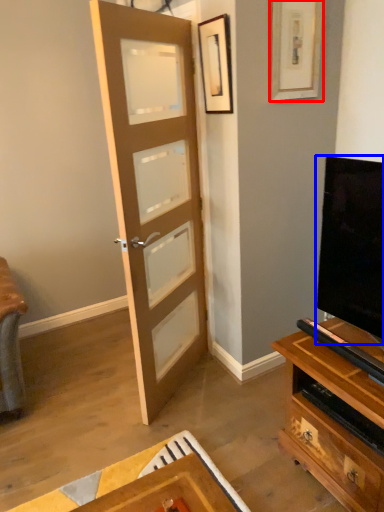
Question: Which object appears closest to the camera in this image, picture frame (highlighted by a red box) or television (highlighted by a blue box)?

Choices:
 (A) picture frame
 (B) television

Answer: (A)